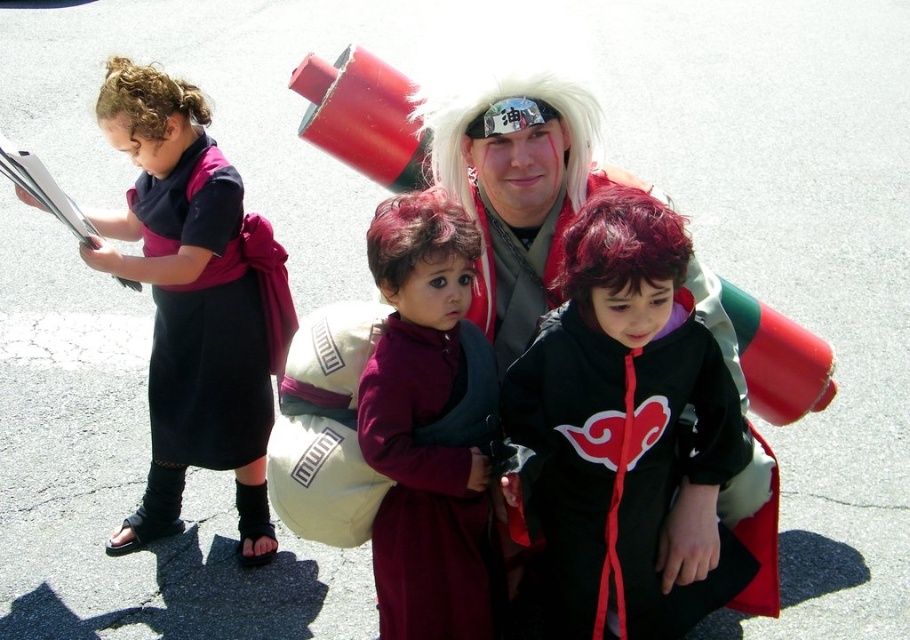
Who is more forward, (274,243) or (393,538)?

Point (393,538) is in front.

Which is behind, point (261, 484) or point (383, 250)?

Point (261, 484)

Does point (249, 332) come in front of point (486, 472)?

No, it is not.

Find the location of a particular element. The image size is (910, 640). matte black hoodie at center is located at coordinates (194, 301).

Which is below, shiny red wig at center or dark red curly wig at center?

shiny red wig at center is lower down.

Is shiny red wig at center bigger than dark red curly wig at center?

Correct, shiny red wig at center is larger in size than dark red curly wig at center.

Is point (570, 284) farther from viewer compared to point (408, 211)?

That is False.

Where is `shiny red wig at center`? The image size is (910, 640). shiny red wig at center is located at coordinates (620, 244).

Is black matte dress at left positioned in front of dark red curly wig at center?

No, black matte dress at left is behind dark red curly wig at center.

Does black matte dress at left have a greater height compared to dark red curly wig at center?

Yes, black matte dress at left is taller than dark red curly wig at center.

Is point (167, 228) positioned before point (387, 232)?

No, (167, 228) is further to viewer.

Where is `black matte dress at left`? Image resolution: width=910 pixels, height=640 pixels. black matte dress at left is located at coordinates (211, 316).